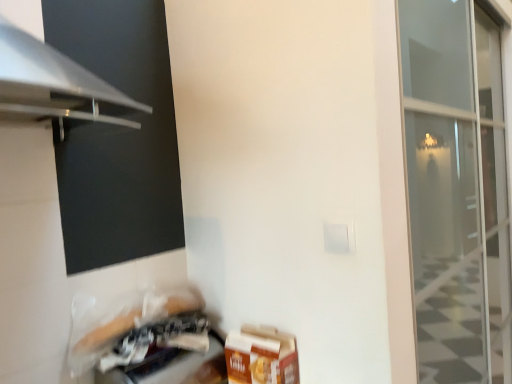
Question: Which is correct: plastic bag at lower left is inside brown cardboard box at lower right, or outside of it?

Choices:
 (A) outside
 (B) inside

Answer: (A)

Question: Is plastic bag at lower left to the left or to the right of brown cardboard box at lower right in the image?

Choices:
 (A) right
 (B) left

Answer: (B)

Question: Which of these objects is positioned farthest from the plastic bag at lower left?

Choices:
 (A) black matte screen at lower left
 (B) brown cardboard box at lower right

Answer: (A)

Question: Considering the real-world distances, which object is farthest from the black matte screen at lower left?

Choices:
 (A) brown cardboard box at lower right
 (B) plastic bag at lower left

Answer: (A)